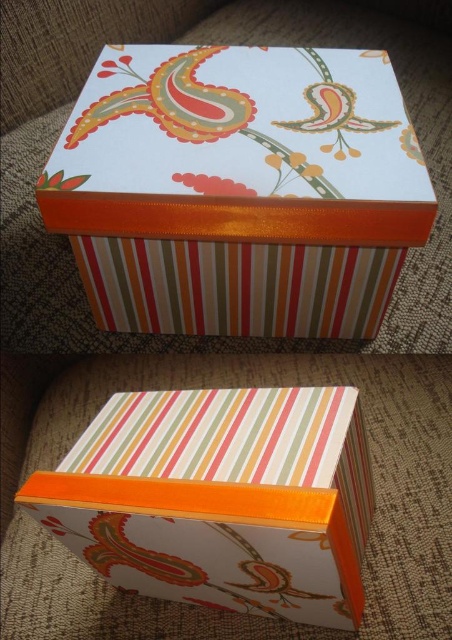
Question: Which of the following is the farthest from the observer?

Choices:
 (A) matte paper box at center
 (B) matte striped box at center

Answer: (A)

Question: Is matte paper box at center to the right of matte striped box at center from the viewer's perspective?

Choices:
 (A) yes
 (B) no

Answer: (A)

Question: Can you confirm if matte paper box at center is positioned above matte striped box at center?

Choices:
 (A) no
 (B) yes

Answer: (B)

Question: Observing the image, what is the correct spatial positioning of matte paper box at center in reference to matte striped box at center?

Choices:
 (A) left
 (B) right

Answer: (B)

Question: Which point is farther from the camera taking this photo?

Choices:
 (A) (267, 442)
 (B) (172, 48)

Answer: (B)